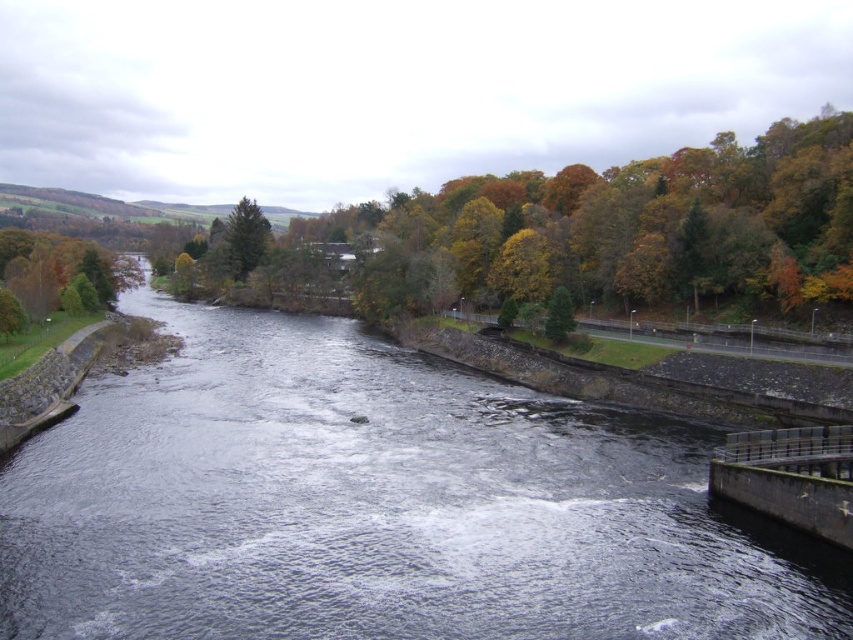
Between dark gray water at center and green matte tree at left, which one has less height?

dark gray water at center

Does dark gray water at center appear on the left side of green matte tree at left?

No, dark gray water at center is not to the left of green matte tree at left.

What do you see at coordinates (378, 506) in the screenshot?
I see `dark gray water at center` at bounding box center [378, 506].

This screenshot has width=853, height=640. What are the coordinates of `dark gray water at center` in the screenshot? It's located at (378, 506).

Is point (68, 310) positioned before point (253, 212)?

Yes, it is in front of point (253, 212).

From the picture: Can you confirm if green matte tree at left is wider than green matte tree at upper center?

Yes.

The image size is (853, 640). I want to click on green matte tree at left, so pyautogui.click(x=61, y=273).

Find the location of a particular element. This screenshot has width=853, height=640. green matte tree at left is located at coordinates (61, 273).

Is point (102, 273) closer to camera compared to point (550, 307)?

No, it is not.

Image resolution: width=853 pixels, height=640 pixels. I want to click on green matte tree at left, so pyautogui.click(x=61, y=273).

This screenshot has height=640, width=853. In order to click on green matte tree at left in this screenshot , I will do `click(61, 273)`.